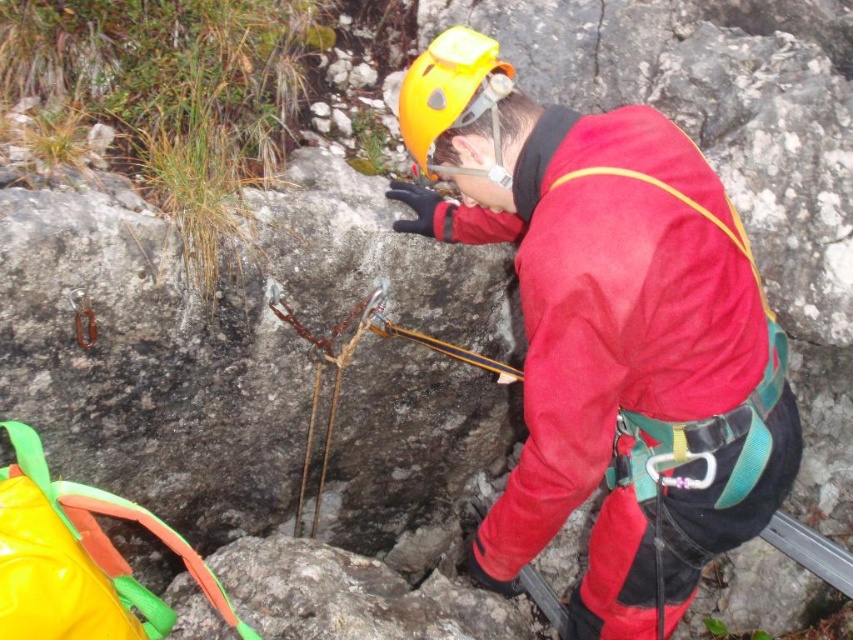
Measure the distance between matte red jacket at center and yellow fabric bag at lower left.

They are 29.95 inches apart.

Which is behind, point (498, 560) or point (107, 500)?

The point (498, 560) is behind.

Find the location of `matte red jacket at center`. matte red jacket at center is located at coordinates coord(608,333).

Can you confirm if yellow fabric bag at lower left is positioned below yellow matte helmet at center?

Yes.

Which is behind, point (229, 605) or point (469, 49)?

The point (229, 605) is behind.

Find the location of a particular element. The width and height of the screenshot is (853, 640). yellow fabric bag at lower left is located at coordinates (78, 557).

Locate an element on the screen. yellow fabric bag at lower left is located at coordinates (78, 557).

The image size is (853, 640). Describe the element at coordinates (608, 333) in the screenshot. I see `matte red jacket at center` at that location.

At what (x,y) coordinates should I click in order to perform the action: click on matte red jacket at center. Please return your answer as a coordinate pair (x, y). The width and height of the screenshot is (853, 640). Looking at the image, I should click on (608, 333).